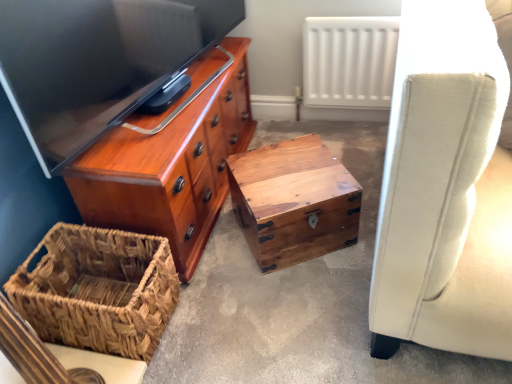
The height and width of the screenshot is (384, 512). Identify the location of free region under white matte radiator at upper center (from a real-world perspective). (344, 117).